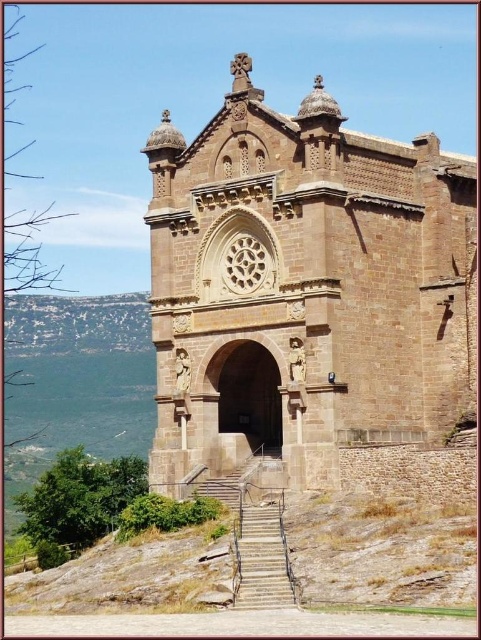
You are standing on the stone textured stairs at center and want to enter the brown stone church at center. In which direction should you walk to reach the entrance?

The brown stone church at center is positioned on the right side of the stone textured stairs at center, so you should walk to the right to reach the entrance.

You are standing at the base of the hill and want to reach the brown stone church at center. The stone textured stairs at center are the only path upwards. If your maximum comfortable walking distance is 50 feet, will you be able to comfortably reach the church from where you are standing?

The brown stone church at center is 47.16 feet away from the stone textured stairs at center. Since your maximum comfortable walking distance is 50 feet, you can comfortably reach the church by walking the 47.16 feet along the stone textured stairs at center.